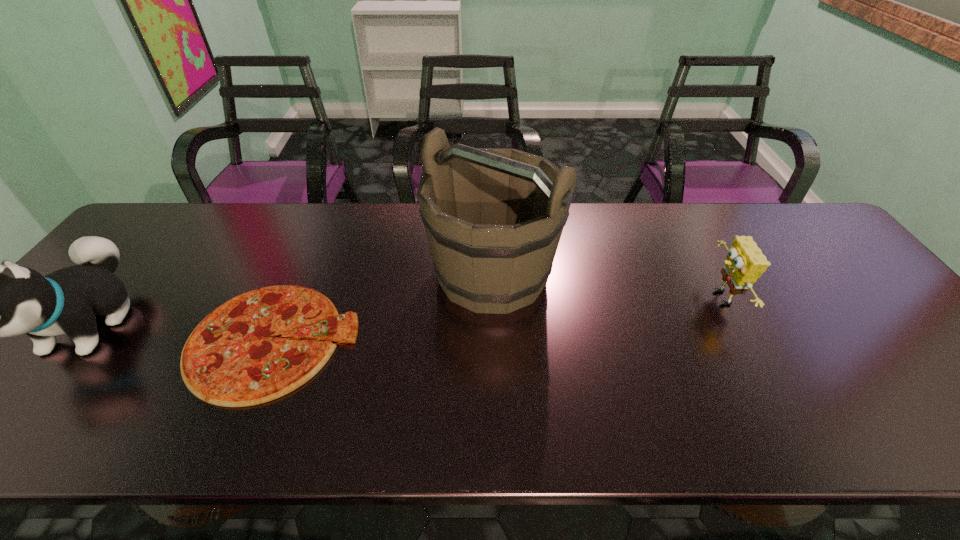
Identify the location of the second object from right to left. [x=494, y=217].

Locate an element on the screen. The width and height of the screenshot is (960, 540). the tallest object is located at coordinates (494, 217).

Identify the location of the second shortest object. The image size is (960, 540). (745, 263).

Identify the location of sponge. (745, 263).

The height and width of the screenshot is (540, 960). I want to click on pizza, so click(x=230, y=359).

The image size is (960, 540). I want to click on the third object from right to left, so click(230, 359).

Image resolution: width=960 pixels, height=540 pixels. I want to click on blank space located 0.230m on the front of the tallest object, so click(x=496, y=407).

I want to click on vacant space positioned on the face of the rightmost object, so click(664, 298).

Locate an element on the screen. Image resolution: width=960 pixels, height=540 pixels. free location located 0.330m on the face of the rightmost object is located at coordinates (580, 298).

Where is `vacant space situated 0.100m on the face of the rightmost object`? vacant space situated 0.100m on the face of the rightmost object is located at coordinates (668, 298).